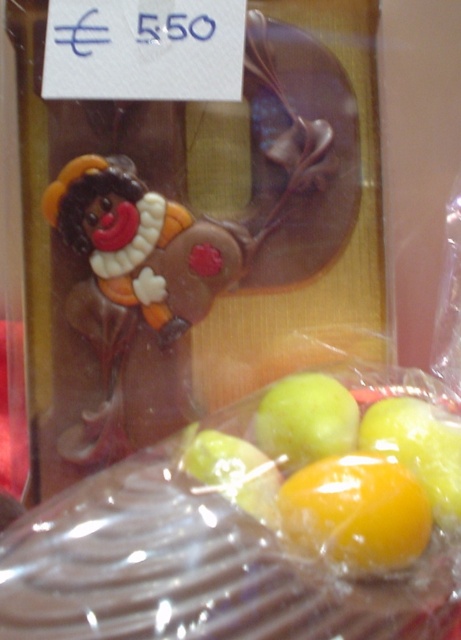
You are a customer at a candy store looking at the packaged chocolate item. The store has a rule that items located at coordinates between 0.7 and 0.8 on both axes are considered premium items. Is the yellow shiny fruit at lower center a premium item?

The yellow shiny fruit at lower center is located at point [356,509], which falls within the 0.7 to 0.8 range on both axes. Therefore, it is a premium item.